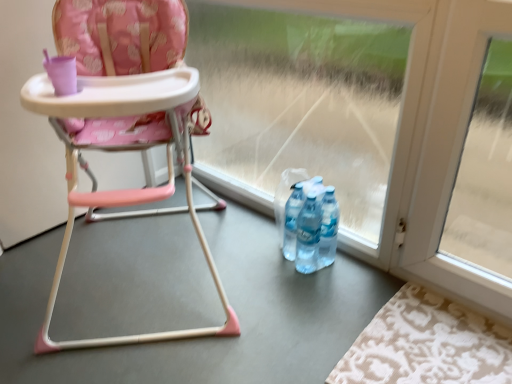
Identify the location of matte plastic highchair at center. (126, 126).

Could you tell me if transparent glass door at center is turned towards matte plastic highchair at center?

Yes.

How much distance is there between transparent glass door at center and matte plastic highchair at center?

54.91 centimeters.

Where is `glass door that appears above the matte plastic highchair at center (from the image's perspective)`? glass door that appears above the matte plastic highchair at center (from the image's perspective) is located at coordinates [x=315, y=104].

Can matte plastic highchair at center be found inside transparent glass door at center?

No.

From a real-world perspective, does matte plastic highchair at center stand above transparent glass door at center?

Yes, from a real-world perspective, matte plastic highchair at center is over transparent glass door at center

Considering the sizes of objects matte plastic highchair at center and transparent glass door at center in the image provided, who is shorter, matte plastic highchair at center or transparent glass door at center?

transparent glass door at center is shorter.

Is matte plastic highchair at center oriented towards transparent glass door at center?

No, matte plastic highchair at center is not aimed at transparent glass door at center.

What's the angular difference between matte plastic highchair at center and transparent glass door at center's facing directions?

The facing directions of matte plastic highchair at center and transparent glass door at center are 47.5 degrees apart.

From the image's perspective, is beige damask rug at lower right on top of matte plastic highchair at center?

No.

Considering the sizes of objects beige damask rug at lower right and matte plastic highchair at center in the image provided, who is smaller, beige damask rug at lower right or matte plastic highchair at center?

Smaller between the two is beige damask rug at lower right.

Can you tell me how much beige damask rug at lower right and matte plastic highchair at center differ in facing direction?

beige damask rug at lower right and matte plastic highchair at center are facing 47.5 degrees away from each other.

Is matte plastic highchair at center further to camera compared to beige damask rug at lower right?

No.

Considering the positions of points (65, 43) and (478, 333), is point (65, 43) farther from camera compared to point (478, 333)?

No.

Would you consider matte plastic highchair at center to be distant from beige damask rug at lower right?

No.

Can you confirm if matte plastic highchair at center is taller than beige damask rug at lower right?

Yes, matte plastic highchair at center is taller than beige damask rug at lower right.

Considering the relative positions of beige damask rug at lower right and transparent glass door at center in the image provided, is beige damask rug at lower right in front of transparent glass door at center?

Yes, it is.

Is beige damask rug at lower right positioned far away from transparent glass door at center?

No, beige damask rug at lower right is not far from transparent glass door at center.

Between beige damask rug at lower right and transparent glass door at center, which one appears on the left side from the viewer's perspective?

transparent glass door at center.

Is beige damask rug at lower right facing away from transparent glass door at center?

No.

Between transparent glass door at center and beige damask rug at lower right, which one has smaller size?

beige damask rug at lower right.

What's the angular difference between transparent glass door at center and beige damask rug at lower right's facing directions?

There is a 0.00275-degree angle between the facing directions of transparent glass door at center and beige damask rug at lower right.

In the scene shown: Is the surface of transparent glass door at center in direct contact with beige damask rug at lower right?

transparent glass door at center is not next to beige damask rug at lower right, and they're not touching.

Find the location of `chair on the left of transparent glass door at center`. chair on the left of transparent glass door at center is located at coordinates (126, 126).

Locate an element on the screen. glass door located behind the matte plastic highchair at center is located at coordinates (315, 104).

Looking at the image, which one is located further to matte plastic highchair at center, beige damask rug at lower right or transparent glass door at center?

beige damask rug at lower right.

Looking at the image, which one is located closer to transparent glass door at center, matte plastic highchair at center or beige damask rug at lower right?

Among the two, matte plastic highchair at center is located nearer to transparent glass door at center.

When comparing their distances from beige damask rug at lower right, does transparent glass door at center or matte plastic highchair at center seem closer?

transparent glass door at center is closer to beige damask rug at lower right.

From the image, which object appears to be farther from beige damask rug at lower right, matte plastic highchair at center or transparent glass door at center?

matte plastic highchair at center is further to beige damask rug at lower right.

Considering their positions, is beige damask rug at lower right positioned further to transparent glass door at center than matte plastic highchair at center?

Among the two, beige damask rug at lower right is located further to transparent glass door at center.

When comparing their distances from matte plastic highchair at center, does transparent glass door at center or beige damask rug at lower right seem closer?

transparent glass door at center lies closer to matte plastic highchair at center than the other object.

You are a GUI agent. You are given a task and a screenshot of the screen. Output one action in this format:
    pyautogui.click(x=<x>, y=<y>)
    Task: Click on the glass door located between matte plastic highchair at center and beige damask rug at lower right in the left-right direction
    The height and width of the screenshot is (384, 512).
    Given the screenshot: What is the action you would take?
    pyautogui.click(x=315, y=104)